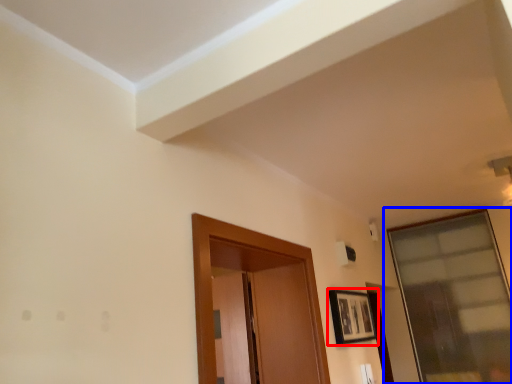
Question: Which object appears farthest to the camera in this image, picture frame (highlighted by a red box) or window (highlighted by a blue box)?

Choices:
 (A) picture frame
 (B) window

Answer: (B)